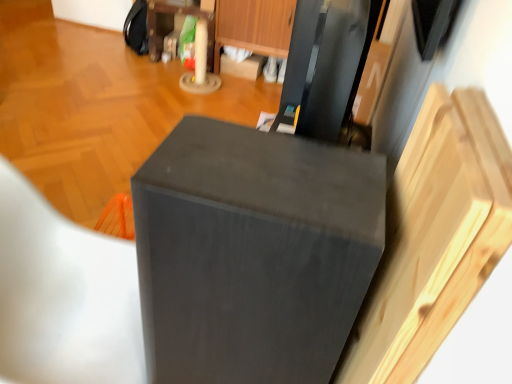
Question: Is wooden drawer at upper center oriented away from matte black folding chair at lower left?

Choices:
 (A) yes
 (B) no

Answer: (B)

Question: Can you confirm if wooden drawer at upper center is positioned to the left of matte black folding chair at lower left?

Choices:
 (A) yes
 (B) no

Answer: (B)

Question: From a real-world perspective, is wooden drawer at upper center physically below matte black folding chair at lower left?

Choices:
 (A) yes
 (B) no

Answer: (A)

Question: From the image's perspective, is wooden drawer at upper center on top of matte black folding chair at lower left?

Choices:
 (A) yes
 (B) no

Answer: (A)

Question: Is the surface of wooden drawer at upper center in direct contact with matte black folding chair at lower left?

Choices:
 (A) yes
 (B) no

Answer: (B)

Question: Is wooden drawer at upper center facing towards matte black folding chair at lower left?

Choices:
 (A) yes
 (B) no

Answer: (A)

Question: Can you confirm if matte wood dresser at upper center is smaller than wooden drawer at upper center?

Choices:
 (A) yes
 (B) no

Answer: (A)

Question: Considering the relative sizes of matte wood dresser at upper center and wooden drawer at upper center in the image provided, is matte wood dresser at upper center shorter than wooden drawer at upper center?

Choices:
 (A) no
 (B) yes

Answer: (B)

Question: From a real-world perspective, is matte wood dresser at upper center on wooden drawer at upper center?

Choices:
 (A) yes
 (B) no

Answer: (B)

Question: Is matte wood dresser at upper center thinner than wooden drawer at upper center?

Choices:
 (A) yes
 (B) no

Answer: (B)

Question: Can you confirm if matte wood dresser at upper center is taller than wooden drawer at upper center?

Choices:
 (A) no
 (B) yes

Answer: (A)

Question: Is matte wood dresser at upper center oriented towards wooden drawer at upper center?

Choices:
 (A) no
 (B) yes

Answer: (A)

Question: Does matte wood dresser at upper center have a larger size compared to matte black speaker at center?

Choices:
 (A) yes
 (B) no

Answer: (A)